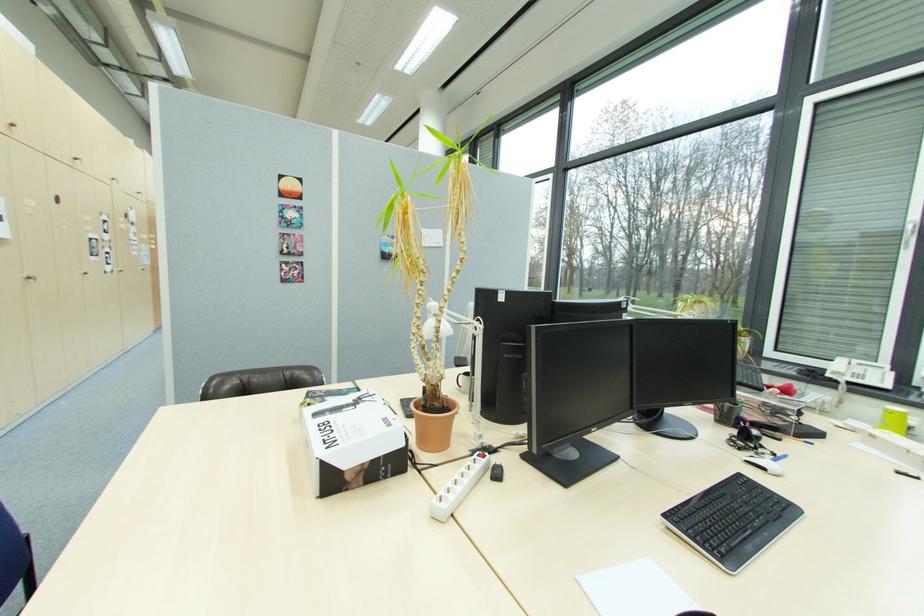
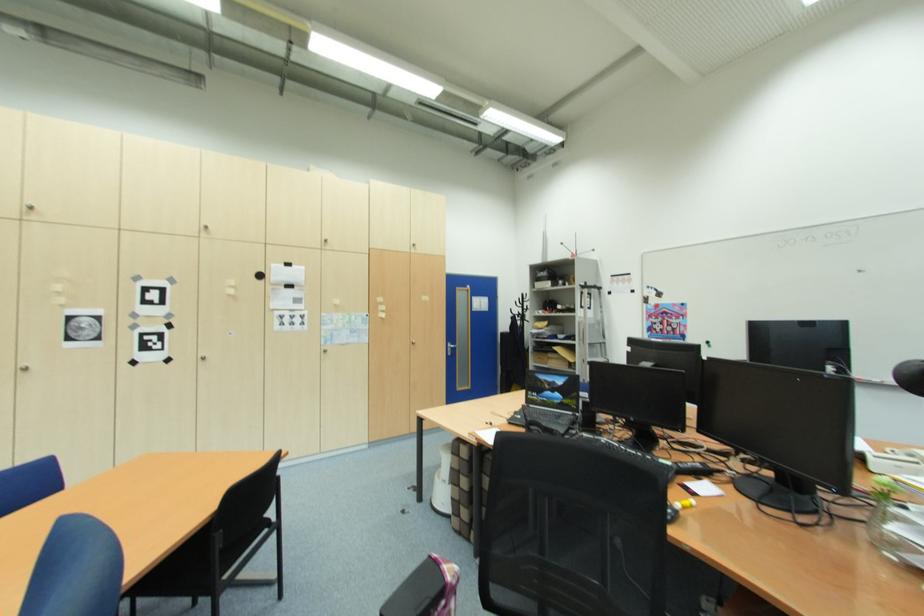
Locate, in the second image, the point that corresponds to (x=126, y=272) in the first image.

(208, 360)